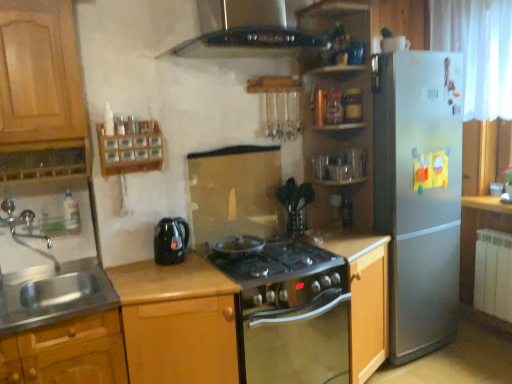
Identify the location of free space to the left of black glossy electric kettle at center-left. The image size is (512, 384). (135, 269).